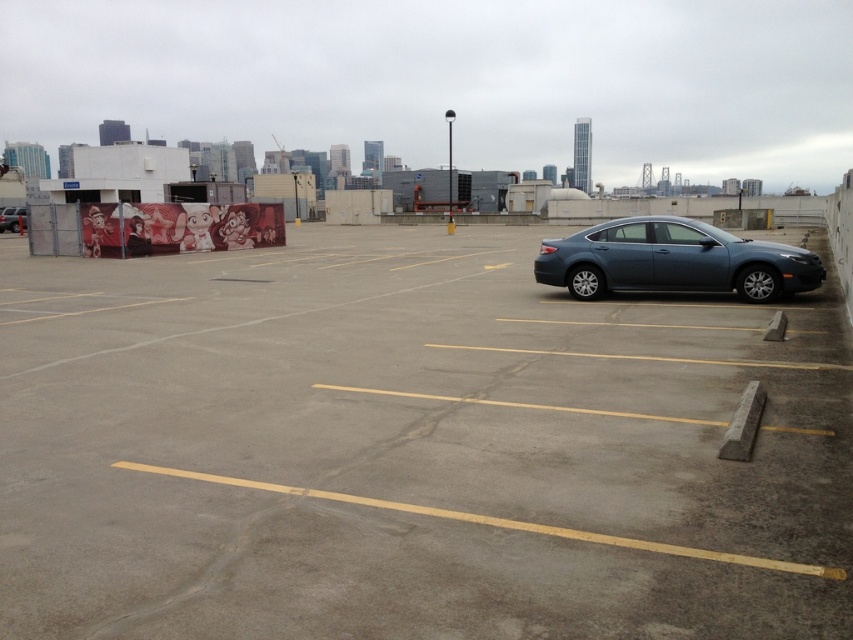
You are standing in the parking lot and want to walk from point (659,225) to point (13,209). Which direction should you face to move towards the second point?

You should face downward because point (659,225) is closer to the viewer than point (13,209).

You are a delivery person trying to park your vehicle in the gray concrete parking lot at center. The satin gray sedan at right is blocking your path. Can you drive around it to access the parking lot?

The gray concrete parking lot at center is in front of the satin gray sedan at right, meaning the sedan is between you and the parking lot. Therefore, you cannot drive around it to access the parking lot directly. You might need to find an alternative route or wait for the sedan to move.

You are a delivery driver who needs to park your vehicle in the gray concrete parking lot at center. However, there is a satin gray sedan at right already parked. Based on their positions, can you safely drive your truck into the parking lot without hitting the parked sedan?

The gray concrete parking lot at center is located below the satin gray sedan at right, meaning the sedan is positioned higher up in the frame. Since the parking lot is below, you can safely drive your truck into the parking lot at center as long as you stay on the lower level and avoid the area where the sedan is parked.